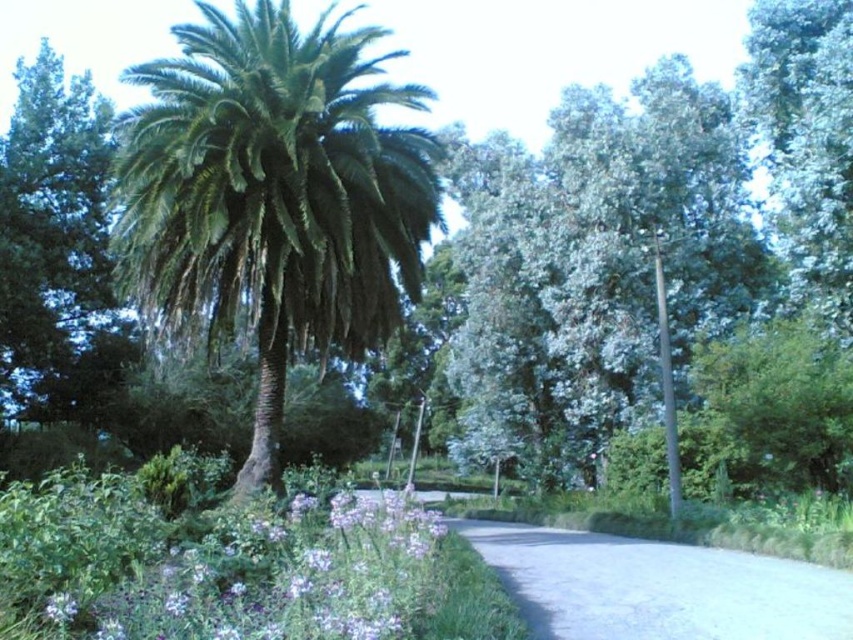
Locate an element on the screen. green leafy palm at center is located at coordinates (273, 195).

In the scene shown: Does green leafy palm at center lie in front of gray concrete driveway at center?

No, green leafy palm at center is further to the viewer.

You are a GUI agent. You are given a task and a screenshot of the screen. Output one action in this format:
    pyautogui.click(x=<x>, y=<y>)
    Task: Click on the green leafy palm at center
    The image size is (853, 640).
    Given the screenshot: What is the action you would take?
    pyautogui.click(x=273, y=195)

Who is shorter, purple soft-textured flowers at lower left or gray concrete driveway at center?

gray concrete driveway at center

Does point (146, 608) come behind point (628, 545)?

No, it is not.

Image resolution: width=853 pixels, height=640 pixels. I want to click on purple soft-textured flowers at lower left, so click(x=279, y=577).

Is green leafy palm at center wider than purple soft-textured flowers at lower left?

Yes, green leafy palm at center is wider than purple soft-textured flowers at lower left.

Measure the distance between green leafy palm at center and purple soft-textured flowers at lower left.

green leafy palm at center and purple soft-textured flowers at lower left are 4.55 meters apart from each other.

Is point (241, 230) in front of point (271, 552)?

No, it is not.

What are the coordinates of `green leafy palm at center` in the screenshot? It's located at (273, 195).